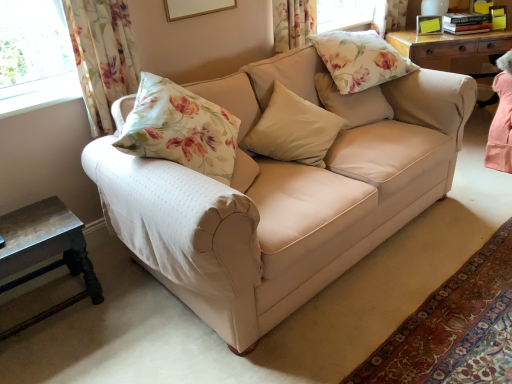
The height and width of the screenshot is (384, 512). I want to click on vacant space to the right of rustic wood side table at lower left, so click(122, 306).